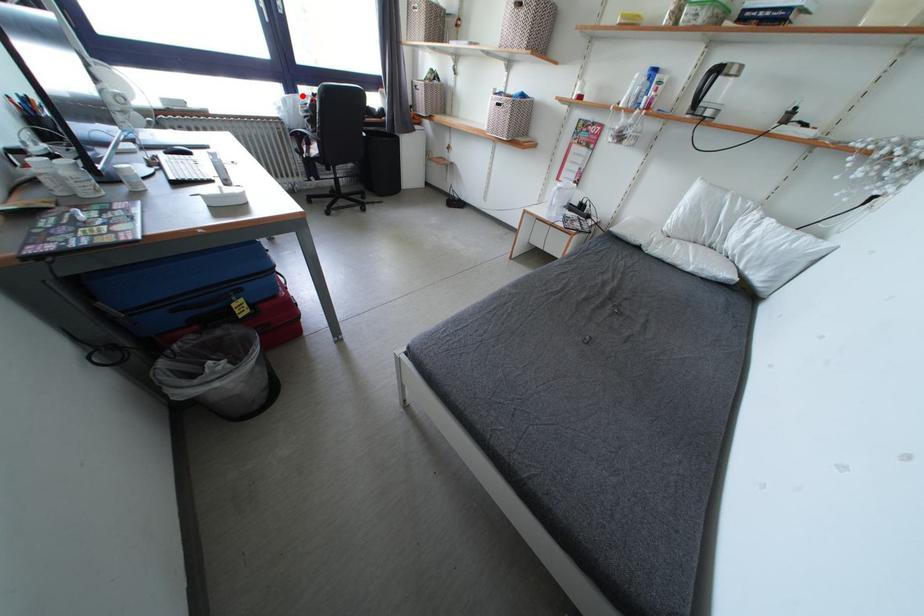
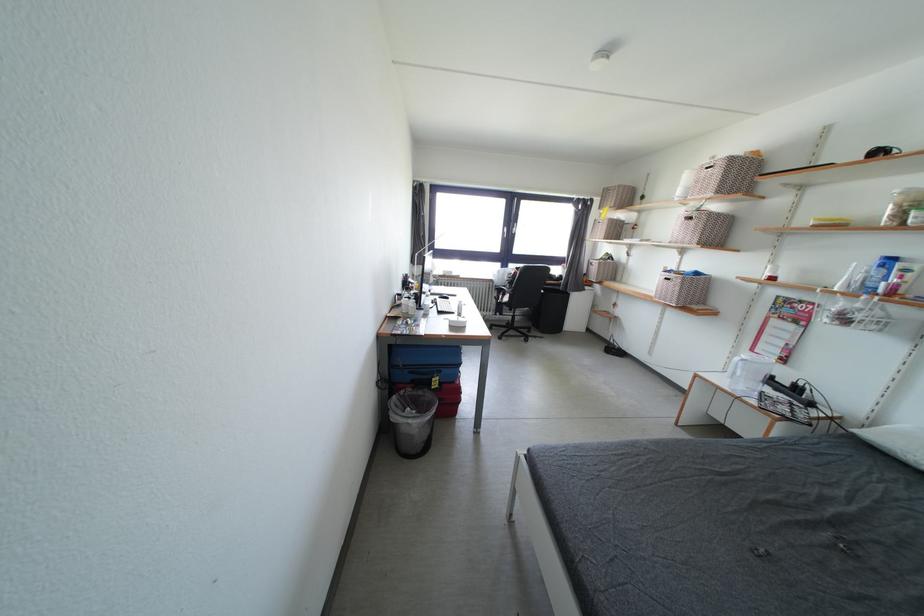
The point at the highlighted location is marked in the first image. Where is the corresponding point in the second image?

(514, 270)